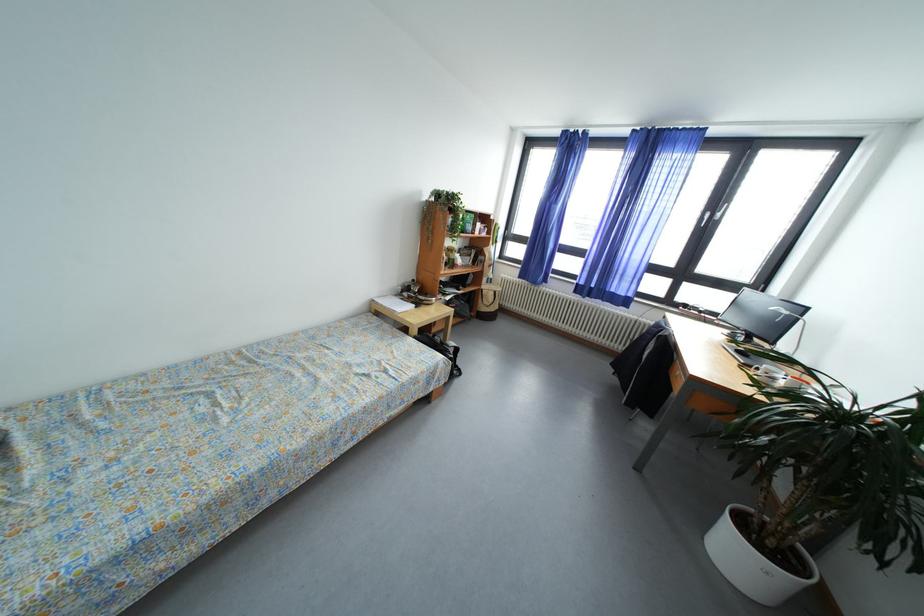
What do you see at coordinates (570, 314) in the screenshot?
I see `the radiator valve knob` at bounding box center [570, 314].